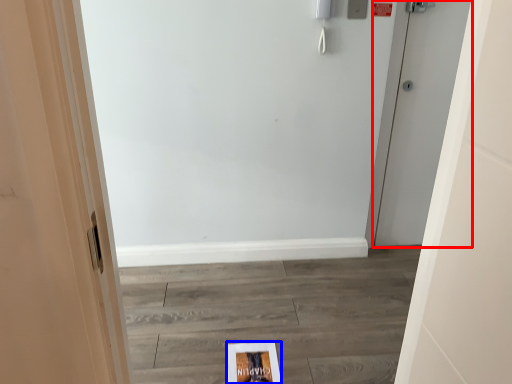
Question: Which object is further to the camera taking this photo, door (highlighted by a red box) or flyer (highlighted by a blue box)?

Choices:
 (A) door
 (B) flyer

Answer: (A)